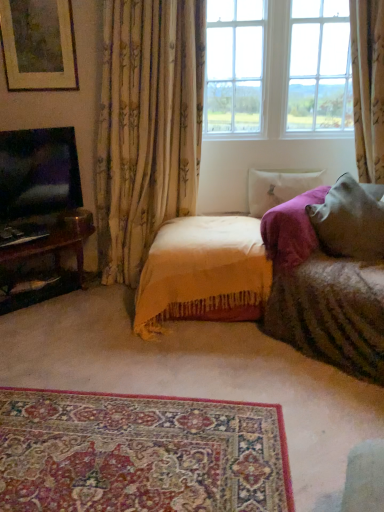
Where is `matte black tv at left`? This screenshot has width=384, height=512. matte black tv at left is located at coordinates (38, 172).

Find the location of a particular element. white soft pillow at upper right, arranged as the 2th pillow when viewed from the front is located at coordinates (278, 188).

The width and height of the screenshot is (384, 512). What do you see at coordinates (147, 127) in the screenshot?
I see `floral fabric curtain at left` at bounding box center [147, 127].

What do you see at coordinates (318, 68) in the screenshot?
I see `clear glass window at upper center` at bounding box center [318, 68].

This screenshot has width=384, height=512. I want to click on clear glass window at upper center, so 318,68.

This screenshot has height=512, width=384. Describe the element at coordinates (38, 44) in the screenshot. I see `matte gold picture frame at upper left` at that location.

This screenshot has width=384, height=512. Identify the location of matte black tv at left. (38, 172).

Image resolution: width=384 pixels, height=512 pixels. I want to click on pillow lying in front of the clear glass window at upper center, so pyautogui.click(x=351, y=220).

Looking at the image, does clear glass window at upper center seem bigger or smaller compared to soft gray pillow at right, the 1th pillow when ordered from front to back?

Considering their sizes, clear glass window at upper center takes up more space than soft gray pillow at right, the 1th pillow when ordered from front to back.

Is point (243, 133) positioned after point (332, 245)?

Yes, point (243, 133) is behind point (332, 245).

From a real-world perspective, between clear glass window at upper center and soft gray pillow at right, placed as the 2th pillow when sorted from back to front, who is vertically lower?

soft gray pillow at right, placed as the 2th pillow when sorted from back to front, from a real-world perspective.

Considering the relative sizes of clear glass window at upper center and carpet with intricate patterns at lower center in the image provided, is clear glass window at upper center thinner than carpet with intricate patterns at lower center?

Correct, the width of clear glass window at upper center is less than that of carpet with intricate patterns at lower center.

Looking at the image, does clear glass window at upper center seem bigger or smaller compared to carpet with intricate patterns at lower center?

In the image, clear glass window at upper center appears to be larger than carpet with intricate patterns at lower center.

Image resolution: width=384 pixels, height=512 pixels. Find the location of `plain that appears below the clear glass window at upper center (from the image's perspective)`. plain that appears below the clear glass window at upper center (from the image's perspective) is located at coordinates (140, 454).

Is carpet with intricate patterns at lower center surrounded by clear glass window at upper center?

No, clear glass window at upper center does not contain carpet with intricate patterns at lower center.

Considering the relative sizes of white soft pillow at upper right, arranged as the 2th pillow when viewed from the front, and velvet yellow blanket at center in the image provided, is white soft pillow at upper right, arranged as the 2th pillow when viewed from the front, smaller than velvet yellow blanket at center?

Correct, white soft pillow at upper right, arranged as the 2th pillow when viewed from the front, occupies less space than velvet yellow blanket at center.

Which of these two, white soft pillow at upper right, the 1th pillow when ordered from back to front, or velvet yellow blanket at center, stands shorter?

white soft pillow at upper right, the 1th pillow when ordered from back to front, is shorter.

In the scene shown: Does white soft pillow at upper right, the 1th pillow when ordered from back to front, appear on the right side of velvet yellow blanket at center?

Yes, white soft pillow at upper right, the 1th pillow when ordered from back to front, is to the right of velvet yellow blanket at center.

This screenshot has width=384, height=512. I want to click on the 1st pillow located above the velvet yellow blanket at center (from a real-world perspective), so click(278, 188).

From a real-world perspective, which object stands above the other?

clear glass window at upper center is physically above.

Is white soft pillow at upper right, arranged as the 2th pillow when viewed from the front, to the left or to the right of clear glass window at upper center in the image?

From the image, it's evident that white soft pillow at upper right, arranged as the 2th pillow when viewed from the front, is to the right of clear glass window at upper center.

Is point (304, 182) closer to camera compared to point (305, 126)?

That is False.

Is matte gold picture frame at upper left wider than floral fabric curtain at left?

In fact, matte gold picture frame at upper left might be narrower than floral fabric curtain at left.

Considering the positions of point (33, 39) and point (160, 208), is point (33, 39) closer or farther from the camera than point (160, 208)?

Clearly, point (33, 39) is closer to the camera than point (160, 208).

In terms of height, does matte gold picture frame at upper left look taller or shorter compared to floral fabric curtain at left?

Clearly, matte gold picture frame at upper left is shorter compared to floral fabric curtain at left.

Visually, is matte gold picture frame at upper left positioned to the left or to the right of floral fabric curtain at left?

From the image, it's evident that matte gold picture frame at upper left is to the left of floral fabric curtain at left.

From a real-world perspective, who is located lower, white soft pillow at upper right, the 1th pillow when ordered from back to front, or floral fabric curtain at left?

From a 3D spatial view, white soft pillow at upper right, the 1th pillow when ordered from back to front, is below.

Is white soft pillow at upper right, arranged as the 2th pillow when viewed from the front, completely or partially outside of floral fabric curtain at left?

Yes, white soft pillow at upper right, arranged as the 2th pillow when viewed from the front, is outside of floral fabric curtain at left.

How many degrees apart are the facing directions of white soft pillow at upper right, arranged as the 2th pillow when viewed from the front, and floral fabric curtain at left?

0.405 degrees separate the facing orientations of white soft pillow at upper right, arranged as the 2th pillow when viewed from the front, and floral fabric curtain at left.

Is white soft pillow at upper right, the 1th pillow when ordered from back to front, wider than floral fabric curtain at left?

In fact, white soft pillow at upper right, the 1th pillow when ordered from back to front, might be narrower than floral fabric curtain at left.

Does carpet with intricate patterns at lower center have a greater width compared to soft gray pillow at right, the 1th pillow when ordered from front to back?

Yes, carpet with intricate patterns at lower center is wider than soft gray pillow at right, the 1th pillow when ordered from front to back.

Which is more to the right, carpet with intricate patterns at lower center or soft gray pillow at right, the 1th pillow when ordered from front to back?

Positioned to the right is soft gray pillow at right, the 1th pillow when ordered from front to back.

From a real-world perspective, is carpet with intricate patterns at lower center under soft gray pillow at right, placed as the 2th pillow when sorted from back to front?

Yes, from a real-world perspective, carpet with intricate patterns at lower center is under soft gray pillow at right, placed as the 2th pillow when sorted from back to front.

Is carpet with intricate patterns at lower center next to soft gray pillow at right, the 1th pillow when ordered from front to back, and touching it?

No, carpet with intricate patterns at lower center is not next to soft gray pillow at right, the 1th pillow when ordered from front to back.

Image resolution: width=384 pixels, height=512 pixels. I want to click on window located above the soft gray pillow at right, the 1th pillow when ordered from front to back (from the image's perspective), so click(x=318, y=68).

At what (x,y) coordinates should I click in order to perform the action: click on window behind the carpet with intricate patterns at lower center. Please return your answer as a coordinate pair (x, y). This screenshot has width=384, height=512. Looking at the image, I should click on click(x=318, y=68).

From the picture: Based on their spatial positions, is matte black tv at left or carpet with intricate patterns at lower center closer to soft gray pillow at right, the 1th pillow when ordered from front to back?

carpet with intricate patterns at lower center is positioned closer to the anchor soft gray pillow at right, the 1th pillow when ordered from front to back.

Which object lies nearer to the anchor point clear glass window at upper center, matte gold picture frame at upper left or white soft pillow at upper right, arranged as the 2th pillow when viewed from the front?

Based on the image, white soft pillow at upper right, arranged as the 2th pillow when viewed from the front, appears to be nearer to clear glass window at upper center.

Considering their positions, is carpet with intricate patterns at lower center positioned further to clear glass window at upper center than soft gray pillow at right, the 1th pillow when ordered from front to back?

carpet with intricate patterns at lower center.

Based on their spatial positions, is white soft pillow at upper right, the 1th pillow when ordered from back to front, or carpet with intricate patterns at lower center further from velvet yellow blanket at center?

Among the two, carpet with intricate patterns at lower center is located further to velvet yellow blanket at center.

Based on their spatial positions, is clear glass window at upper center or carpet with intricate patterns at lower center closer to matte gold picture frame at upper left?

clear glass window at upper center lies closer to matte gold picture frame at upper left than the other object.

When comparing their distances from carpet with intricate patterns at lower center, does soft gray pillow at right, the 1th pillow when ordered from front to back, or velvet yellow blanket at center seem closer?

Based on the image, velvet yellow blanket at center appears to be nearer to carpet with intricate patterns at lower center.

In the scene shown: Looking at the image, which one is located closer to matte gold picture frame at upper left, soft gray pillow at right, the 1th pillow when ordered from front to back, or white soft pillow at upper right, arranged as the 2th pillow when viewed from the front?

Based on the image, white soft pillow at upper right, arranged as the 2th pillow when viewed from the front, appears to be nearer to matte gold picture frame at upper left.

In the scene shown: Based on their spatial positions, is soft gray pillow at right, the 1th pillow when ordered from front to back, or clear glass window at upper center closer to matte gold picture frame at upper left?

clear glass window at upper center is closer to matte gold picture frame at upper left.

Where is `television between matte gold picture frame at upper left and white soft pillow at upper right, the 1th pillow when ordered from back to front, in the horizontal direction`? The image size is (384, 512). television between matte gold picture frame at upper left and white soft pillow at upper right, the 1th pillow when ordered from back to front, in the horizontal direction is located at coordinates (38, 172).

Identify the location of curtain between matte black tv at left and velvet yellow blanket at center. (147, 127).

Identify the location of curtain between matte gold picture frame at upper left and carpet with intricate patterns at lower center in the up-down direction. The height and width of the screenshot is (512, 384). (147, 127).

At what (x,y) coordinates should I click in order to perform the action: click on pillow situated between matte black tv at left and soft gray pillow at right, the 1th pillow when ordered from front to back, from left to right. Please return your answer as a coordinate pair (x, y). Looking at the image, I should click on (278, 188).